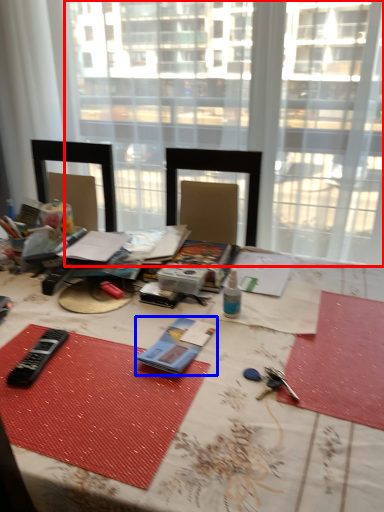
Question: Which of the following is the closest to the observer, window (highlighted by a red box) or equipment (highlighted by a blue box)?

Choices:
 (A) window
 (B) equipment

Answer: (B)